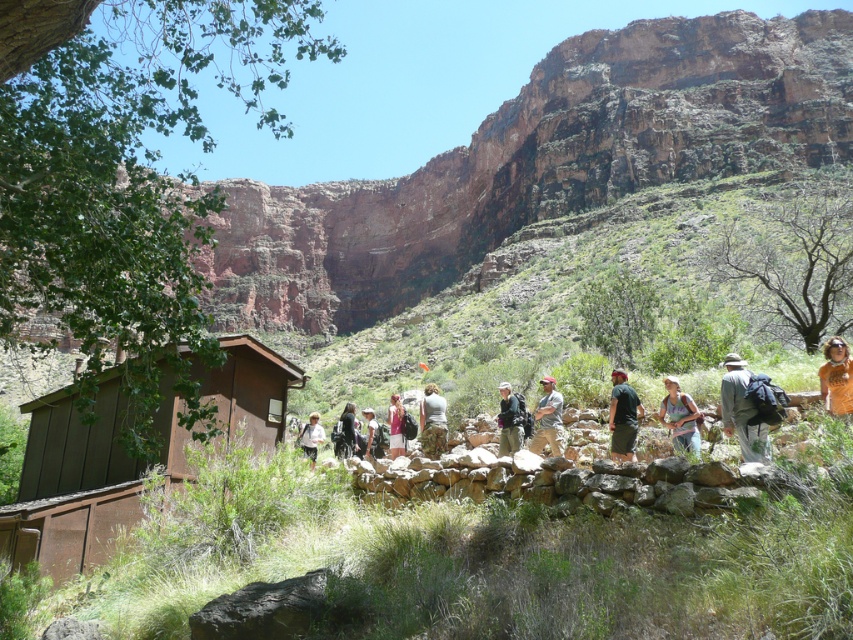
Consider the image. You are a hiker who wants to check the contents of your gray fabric backpack at right without disturbing your green fabric pants at center. Can you reach it easily?

The gray fabric backpack at right is positioned on the right side of green fabric pants at center, so you can reach it easily without disturbing the green fabric pants at center.

Based on the photo, you are a hiker trying to decide which backpack to take from the two at the center of the image. The dark gray backpack at center and the camouflage fabric backpack at center. Which one is positioned higher?

The dark gray backpack at center is above camouflage fabric backpack at center, so it is positioned higher.